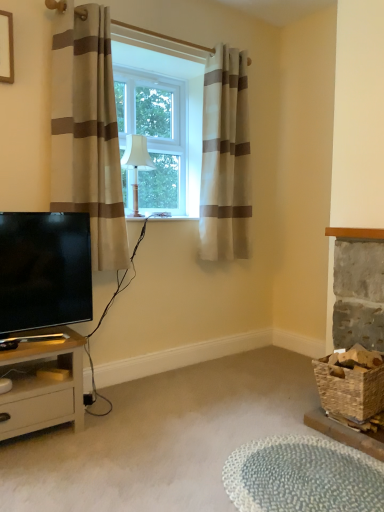
At what (x,y) coordinates should I click in order to perform the action: click on vacant area that lies in front of light beige wood nightstand at lower left. Please return your answer as a coordinate pair (x, y). Looking at the image, I should click on (39, 470).